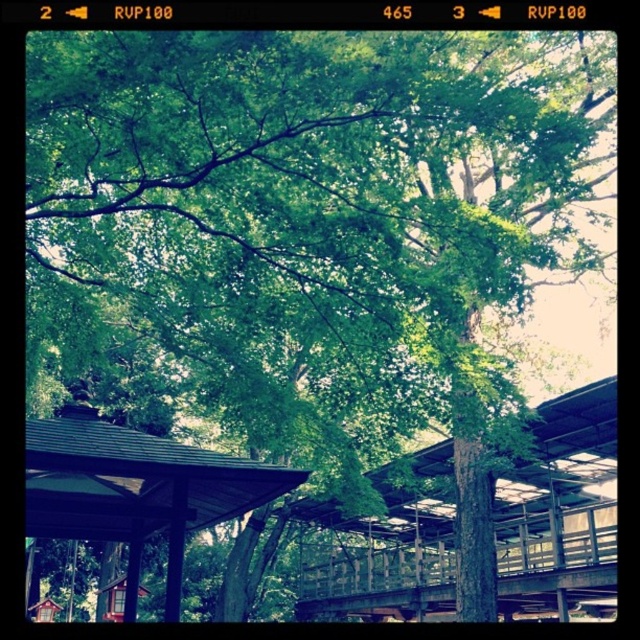
You are standing at the entrance of the brown wooden shelter at lower left. Looking towards the metallic gray pavilion at center, which direction should you walk to reach it?

You should walk to your right since the metallic gray pavilion at center is located to the right of the brown wooden shelter at lower left.

You are standing in the outdoor scene and want to walk from point A to point B. Point A is at coordinates point (536, 541) and point B is at coordinates point (282, 474). Which point is closer to you when you start walking?

Point A at coordinates point (536, 541) is closer to you than point B at coordinates point (282, 474) because it is further to the viewer, making it the first point you would encounter on your path.